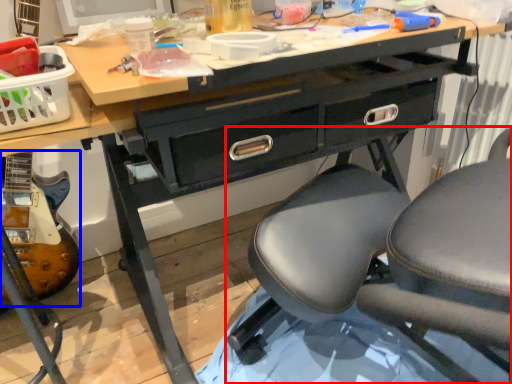
Question: Among these objects, which one is farthest to the camera, chair (highlighted by a red box) or equipment (highlighted by a blue box)?

Choices:
 (A) chair
 (B) equipment

Answer: (B)